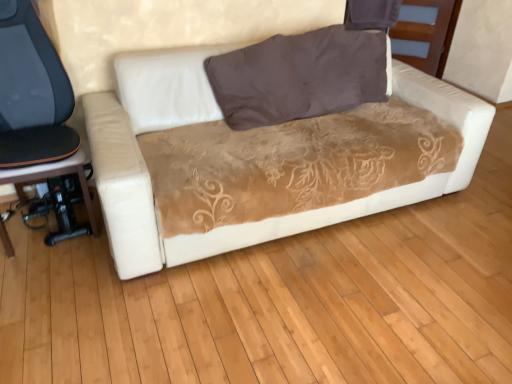
Question: Is brown velvety pillow at upper center positioned far away from velvet brown couch at center?

Choices:
 (A) yes
 (B) no

Answer: (B)

Question: From the image's perspective, is brown velvety pillow at upper center above velvet brown couch at center?

Choices:
 (A) yes
 (B) no

Answer: (A)

Question: Is brown velvety pillow at upper center not within velvet brown couch at center?

Choices:
 (A) yes
 (B) no

Answer: (B)

Question: Does brown velvety pillow at upper center have a greater height compared to velvet brown couch at center?

Choices:
 (A) yes
 (B) no

Answer: (B)

Question: Does brown velvety pillow at upper center contain velvet brown couch at center?

Choices:
 (A) yes
 (B) no

Answer: (B)

Question: Considering the relative sizes of brown velvety pillow at upper center and velvet brown couch at center in the image provided, is brown velvety pillow at upper center shorter than velvet brown couch at center?

Choices:
 (A) yes
 (B) no

Answer: (A)

Question: Is the depth of velvet brown couch at center greater than that of black leather chair at left?

Choices:
 (A) yes
 (B) no

Answer: (B)

Question: Can you confirm if velvet brown couch at center is shorter than black leather chair at left?

Choices:
 (A) yes
 (B) no

Answer: (A)

Question: From the image's perspective, is velvet brown couch at center located above black leather chair at left?

Choices:
 (A) no
 (B) yes

Answer: (B)

Question: Are velvet brown couch at center and black leather chair at left making contact?

Choices:
 (A) yes
 (B) no

Answer: (B)

Question: Can black leather chair at left be found inside velvet brown couch at center?

Choices:
 (A) no
 (B) yes

Answer: (A)

Question: Is velvet brown couch at center oriented towards black leather chair at left?

Choices:
 (A) yes
 (B) no

Answer: (B)

Question: Is velvet brown couch at center completely or partially outside of brown velvety pillow at upper center?

Choices:
 (A) yes
 (B) no

Answer: (A)